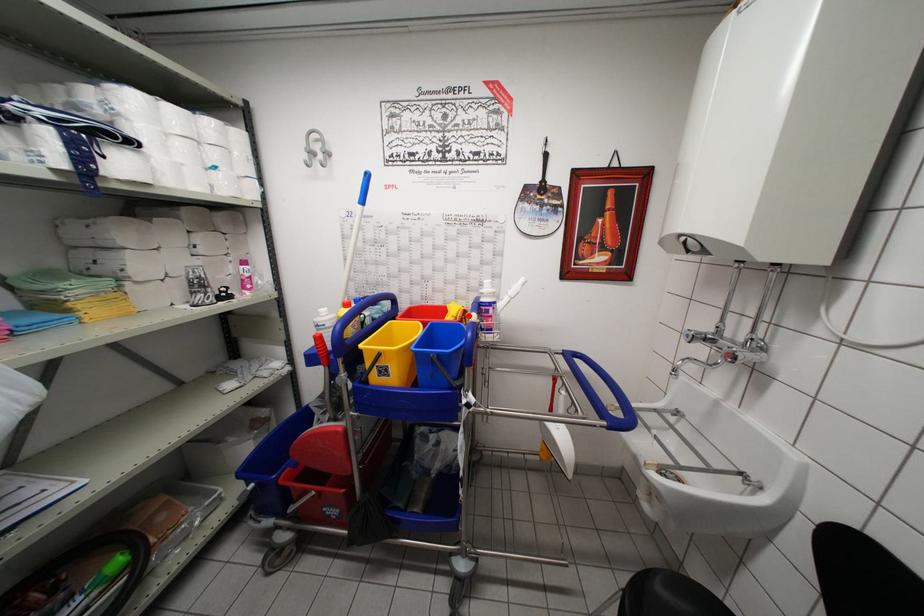
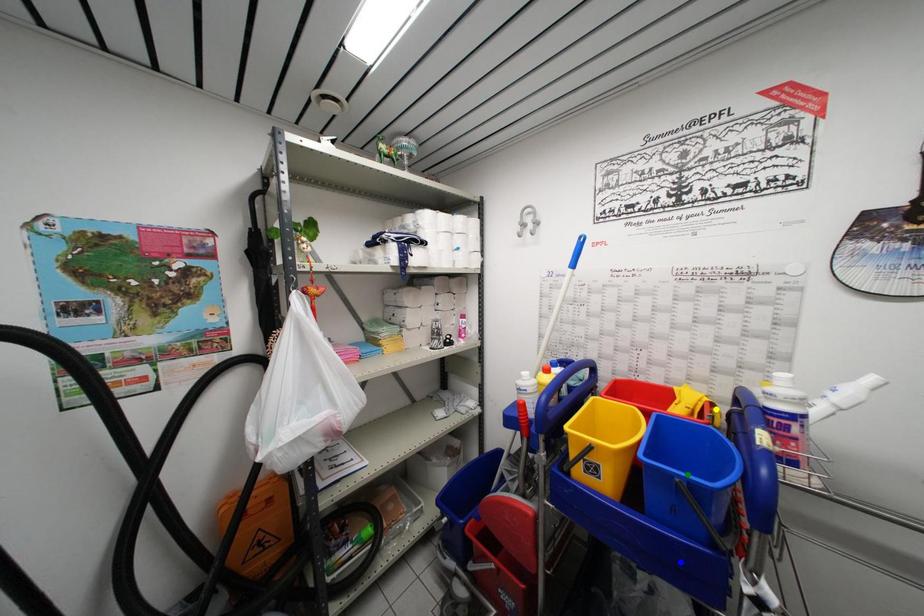
Question: I am providing you with two images of the same scene from different viewpoints. A red point is marked on the first image. You are given multiple points on the second image. Which spot in image 2 lines up with the point in image 1?

Choices:
 (A) green point
 (B) yellow point
 (C) blue point

Answer: (B)